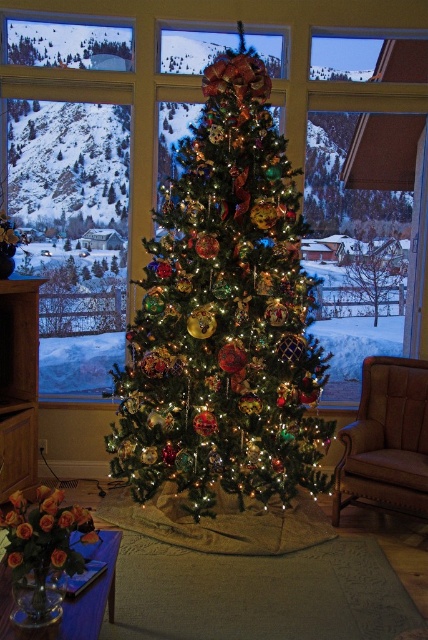
Which of these two, brown leather armchair at right or green matte tree at center, stands taller?

brown leather armchair at right is taller.

Is brown leather armchair at right to the right of green matte tree at center from the viewer's perspective?

In fact, brown leather armchair at right is to the left of green matte tree at center.

Which is in front, point (412, 428) or point (365, 257)?

Point (412, 428)

Find the location of a particular element. The image size is (428, 640). brown leather armchair at right is located at coordinates (386, 440).

Who is positioned more to the right, shiny green christmas tree at center or green matte tree at center?

From the viewer's perspective, green matte tree at center appears more on the right side.

Who is higher up, shiny green christmas tree at center or green matte tree at center?

shiny green christmas tree at center

The width and height of the screenshot is (428, 640). What do you see at coordinates (225, 316) in the screenshot?
I see `shiny green christmas tree at center` at bounding box center [225, 316].

This screenshot has height=640, width=428. Identify the location of shiny green christmas tree at center. (225, 316).

Which is below, shiny green christmas tree at center or brown leather armchair at right?

brown leather armchair at right is lower down.

Can you confirm if shiny green christmas tree at center is positioned below brown leather armchair at right?

Actually, shiny green christmas tree at center is above brown leather armchair at right.

Between point (228, 109) and point (374, 376), which one is positioned behind?

The point (374, 376) is more distant.

Identify the location of shiny green christmas tree at center. (225, 316).